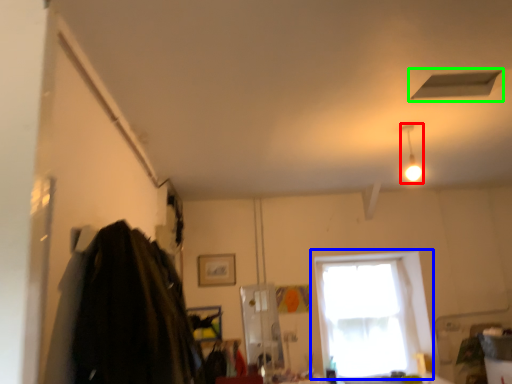
Question: Estimate the real-world distances between objects in this image. Which object is closer to light fixture (highlighted by a red box), window (highlighted by a blue box) or exhaust hood (highlighted by a green box)?

Choices:
 (A) window
 (B) exhaust hood

Answer: (B)